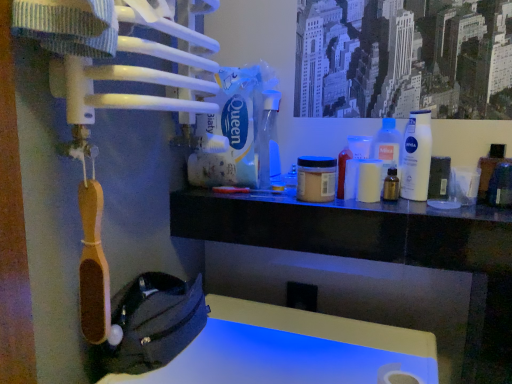
This screenshot has width=512, height=384. I want to click on free location in front of translucent amber bottle at center, which is the second bottle in left-to-right order, so click(417, 207).